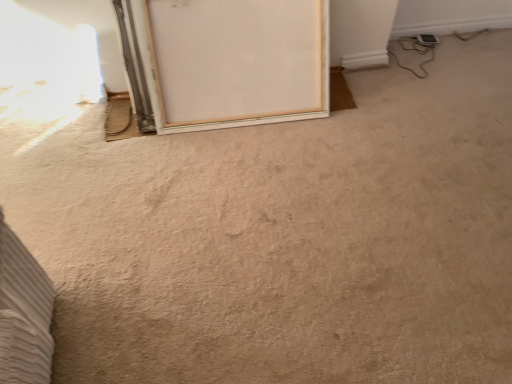
You are a GUI agent. You are given a task and a screenshot of the screen. Output one action in this format:
    pyautogui.click(x=<x>, y=<y>)
    Task: Click on the white wood door at upper center
    The image size is (512, 384).
    Given the screenshot: What is the action you would take?
    pyautogui.click(x=232, y=61)

Describe the element at coordinates (232, 61) in the screenshot. I see `white wood door at upper center` at that location.

Identify the location of white wood door at upper center. Image resolution: width=512 pixels, height=384 pixels. (232, 61).